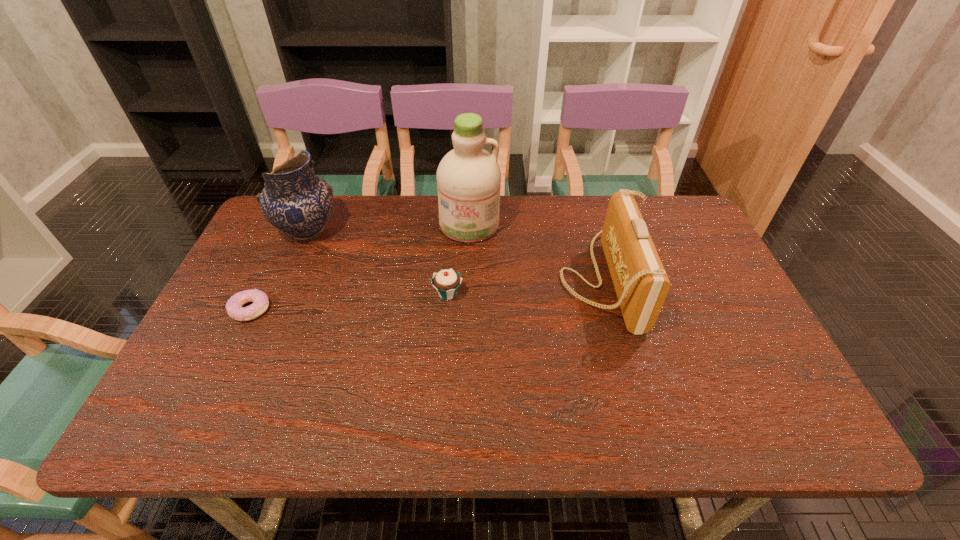
Identify the location of vacant point at the near edge. (291, 420).

Where is `free spot at the far left corner of the desktop`? Image resolution: width=960 pixels, height=540 pixels. free spot at the far left corner of the desktop is located at coordinates (259, 238).

This screenshot has width=960, height=540. Find the location of `vacant space at the far right corner of the desktop`. vacant space at the far right corner of the desktop is located at coordinates (689, 231).

This screenshot has height=540, width=960. I want to click on free space that is in between the doughnut and the fourth shortest object, so click(x=279, y=271).

This screenshot has height=540, width=960. In order to click on vacant space that's between the rightmost object and the tallest object in this screenshot , I will do `click(536, 252)`.

Where is `vacant space that is in between the tallest object and the handbag`? The image size is (960, 540). vacant space that is in between the tallest object and the handbag is located at coordinates (536, 252).

Where is `vacant area that lies between the cleansing agent and the rightmost object`? vacant area that lies between the cleansing agent and the rightmost object is located at coordinates (536, 252).

Find the location of `free point between the handbag and the tallest object`. free point between the handbag and the tallest object is located at coordinates (536, 252).

The height and width of the screenshot is (540, 960). I want to click on free space between the doughnut and the handbag, so click(426, 295).

You are a GUI agent. You are given a task and a screenshot of the screen. Output one action in this format:
    pyautogui.click(x=<x>, y=<y>)
    Task: Click on the vacant area that lies between the handbag and the cupcake
    
    Given the screenshot: What is the action you would take?
    pyautogui.click(x=524, y=287)